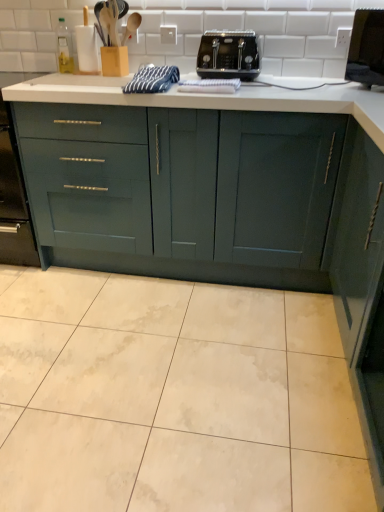
Question: In which direction should I rotate to look at white plastic electric outlet at upper center?

Choices:
 (A) right
 (B) left

Answer: (B)

Question: Does black plastic toaster at center have a greater height compared to matte dark green cabinet at right, which ranks as the 1th cabinetry in right-to-left order?

Choices:
 (A) yes
 (B) no

Answer: (B)

Question: Is black plastic toaster at center with matte dark green cabinet at right, which ranks as the 1th cabinetry in right-to-left order?

Choices:
 (A) yes
 (B) no

Answer: (B)

Question: Is black plastic toaster at center at the left side of matte dark green cabinet at right, which ranks as the 1th cabinetry in right-to-left order?

Choices:
 (A) yes
 (B) no

Answer: (A)

Question: Is matte dark green cabinet at right, which ranks as the 1th cabinetry in right-to-left order, at the back of black plastic toaster at center?

Choices:
 (A) no
 (B) yes

Answer: (A)

Question: Is matte dark green cabinet at right, which ranks as the 1th cabinetry in right-to-left order, completely or partially inside black plastic toaster at center?

Choices:
 (A) no
 (B) yes

Answer: (A)

Question: Does black plastic toaster at center have a greater width compared to matte dark green cabinet at right, which ranks as the 1th cabinetry in right-to-left order?

Choices:
 (A) no
 (B) yes

Answer: (A)

Question: Is teal matte cabinet at center, which appears as the 2th cabinetry when viewed from the right, at the left side of blue striped towel at center?

Choices:
 (A) yes
 (B) no

Answer: (B)

Question: Does teal matte cabinet at center, acting as the first cabinetry starting from the left, turn towards blue striped towel at center?

Choices:
 (A) no
 (B) yes

Answer: (A)

Question: From a real-world perspective, is teal matte cabinet at center, acting as the first cabinetry starting from the left, over blue striped towel at center?

Choices:
 (A) yes
 (B) no

Answer: (B)

Question: Is there a large distance between teal matte cabinet at center, acting as the first cabinetry starting from the left, and blue striped towel at center?

Choices:
 (A) no
 (B) yes

Answer: (A)

Question: Considering the relative sizes of teal matte cabinet at center, which appears as the 2th cabinetry when viewed from the right, and blue striped towel at center in the image provided, is teal matte cabinet at center, which appears as the 2th cabinetry when viewed from the right, shorter than blue striped towel at center?

Choices:
 (A) yes
 (B) no

Answer: (B)

Question: Is blue striped towel at center surrounded by teal matte cabinet at center, which appears as the 2th cabinetry when viewed from the right?

Choices:
 (A) yes
 (B) no

Answer: (B)

Question: Considering the relative sizes of blue striped towel at center and teal matte cabinet at center, acting as the first cabinetry starting from the left, in the image provided, is blue striped towel at center thinner than teal matte cabinet at center, acting as the first cabinetry starting from the left,?

Choices:
 (A) yes
 (B) no

Answer: (A)